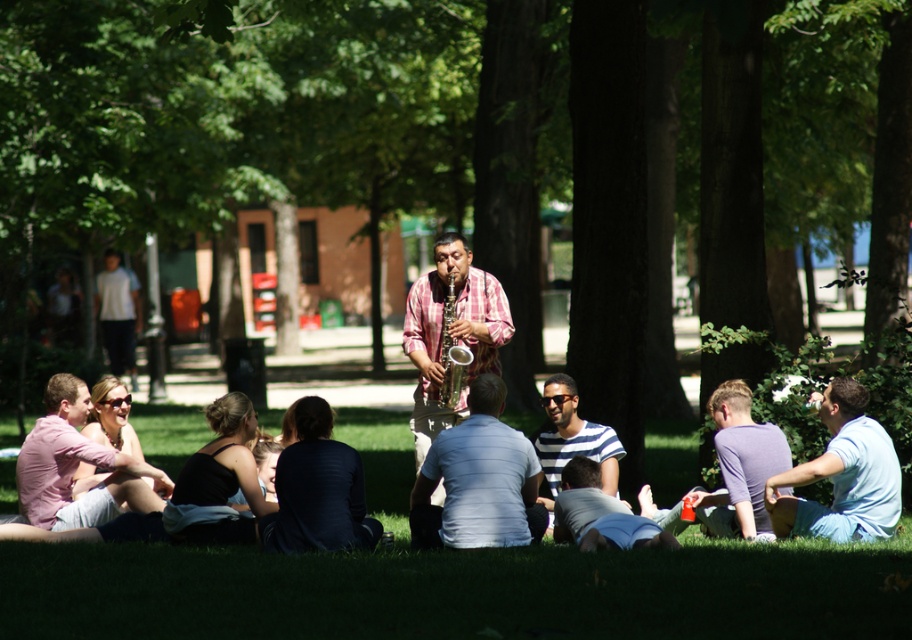
Who is positioned more to the left, green grass at center or light blue shirt at center?

From the viewer's perspective, light blue shirt at center appears more on the left side.

Which is in front, point (235, 624) or point (119, 273)?

Point (235, 624) is in front.

Is point (485, 636) in front of point (132, 336)?

Yes, it is in front of point (132, 336).

Where is `green grass at center`? green grass at center is located at coordinates (452, 580).

You are a GUI agent. You are given a task and a screenshot of the screen. Output one action in this format:
    pyautogui.click(x=<x>, y=<y>)
    Task: Click on the light blue cotton shirt at lower right
    The width and height of the screenshot is (912, 640).
    Given the screenshot: What is the action you would take?
    pyautogui.click(x=842, y=474)

Which is behind, point (834, 444) or point (711, 524)?

The point (711, 524) is more distant.

At what (x,y) coordinates should I click in order to perform the action: click on light blue cotton shirt at lower right. Please return your answer as a coordinate pair (x, y). This screenshot has width=912, height=640. Looking at the image, I should click on (842, 474).

Is light blue cotton shirt at center positioned at the back of light blue cotton shirt at lower center?

Yes.

Does light blue cotton shirt at center have a smaller size compared to light blue cotton shirt at lower center?

No, light blue cotton shirt at center is not smaller than light blue cotton shirt at lower center.

Is point (459, 515) positioned after point (582, 508)?

That is False.

Where is `light blue cotton shirt at center`? Image resolution: width=912 pixels, height=640 pixels. light blue cotton shirt at center is located at coordinates pyautogui.click(x=478, y=481).